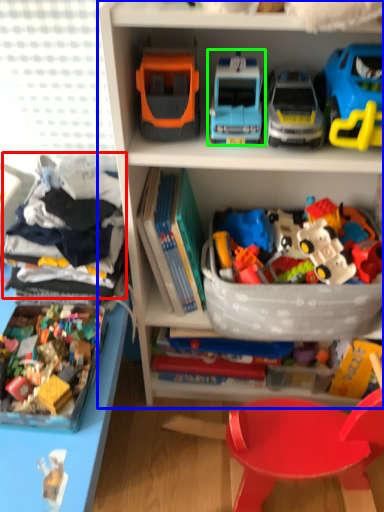
Question: Estimate the real-world distances between objects in this image. Which object is closer to clothing (highlighted by a red box), bookcase (highlighted by a blue box) or toy (highlighted by a green box)?

Choices:
 (A) bookcase
 (B) toy

Answer: (A)